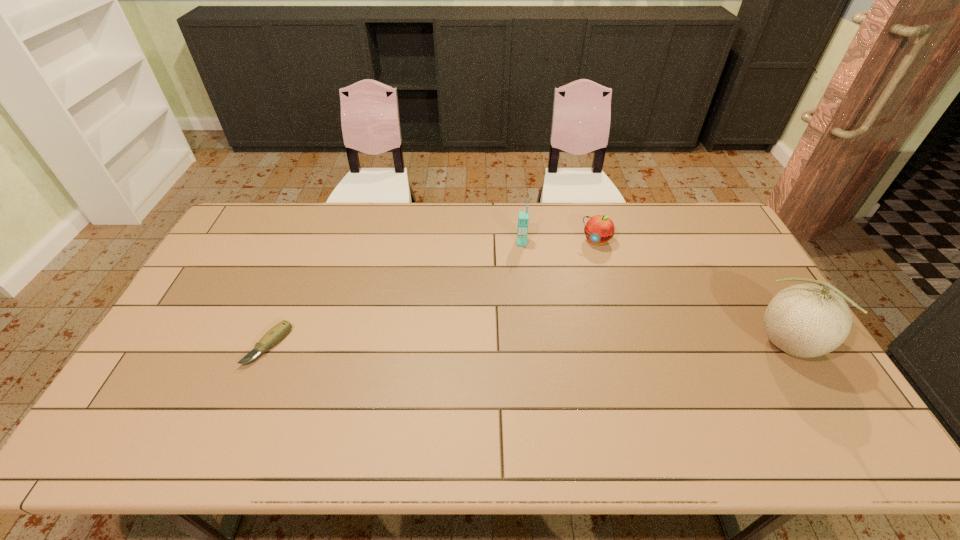
Where is `empty space that is in between the leftmost object and the second tallest object`? The height and width of the screenshot is (540, 960). empty space that is in between the leftmost object and the second tallest object is located at coordinates (395, 294).

I want to click on free spot between the third object from left to right and the tallest object, so click(x=692, y=293).

Identify the location of free space between the second shortest object and the pocketknife. (432, 293).

Locate which object is the closest to the cantaloup. Please provide its 2D coordinates. Your answer should be formatted as a tuple, i.e. [(x, y)], where the tuple contains the x and y coordinates of a point satisfying the conditions above.

[(599, 229)]

Choose which object is the nearest neighbor to the leftmost object. Please provide its 2D coordinates. Your answer should be formatted as a tuple, i.e. [(x, y)], where the tuple contains the x and y coordinates of a point satisfying the conditions above.

[(523, 218)]

The width and height of the screenshot is (960, 540). Find the location of `vacant area in the image that satisfies the following two spatial constraints: 1. on the back side of the apple; 2. on the right side of the cellular telephone`. vacant area in the image that satisfies the following two spatial constraints: 1. on the back side of the apple; 2. on the right side of the cellular telephone is located at coordinates (521, 241).

Identify the location of vacant space that satisfies the following two spatial constraints: 1. on the back side of the third object from left to right; 2. on the right side of the third object from right to left. (521, 241).

Identify the location of vacant point that satisfies the following two spatial constraints: 1. on the front side of the cellular telephone; 2. on the left side of the cantaloup. The height and width of the screenshot is (540, 960). (532, 346).